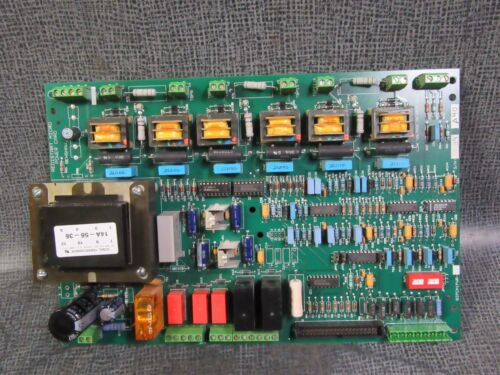
Where is `sticker`? The image size is (500, 375). sticker is located at coordinates (85, 240).